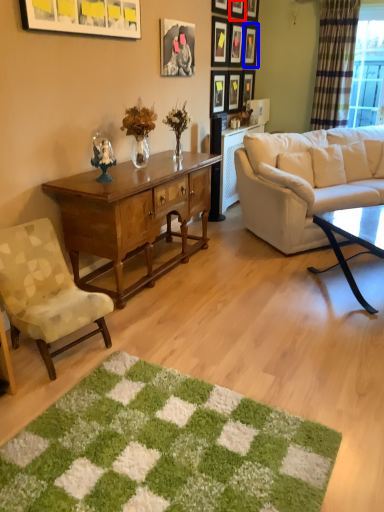
Question: Which point is further to the camera, picture frame (highlighted by a red box) or picture frame (highlighted by a blue box)?

Choices:
 (A) picture frame
 (B) picture frame

Answer: (B)